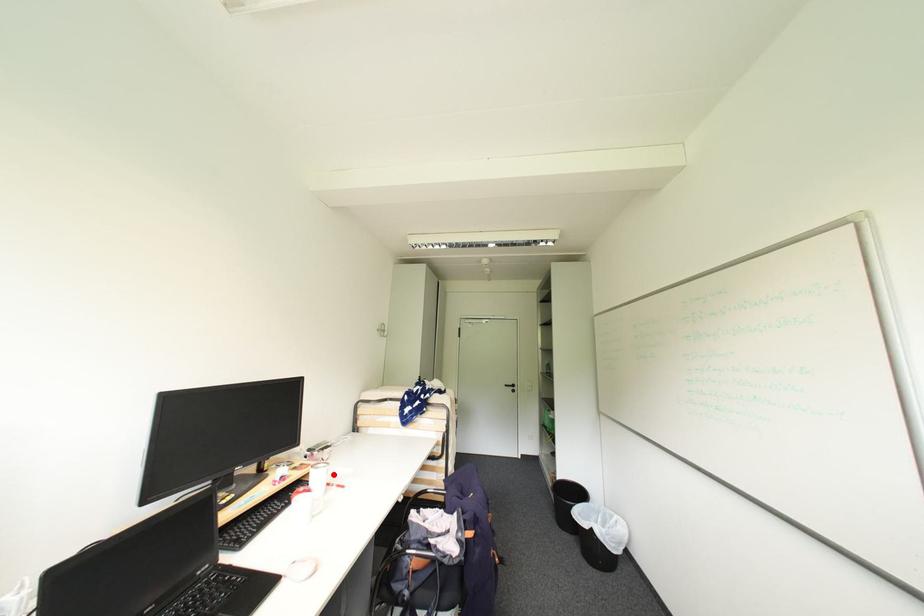
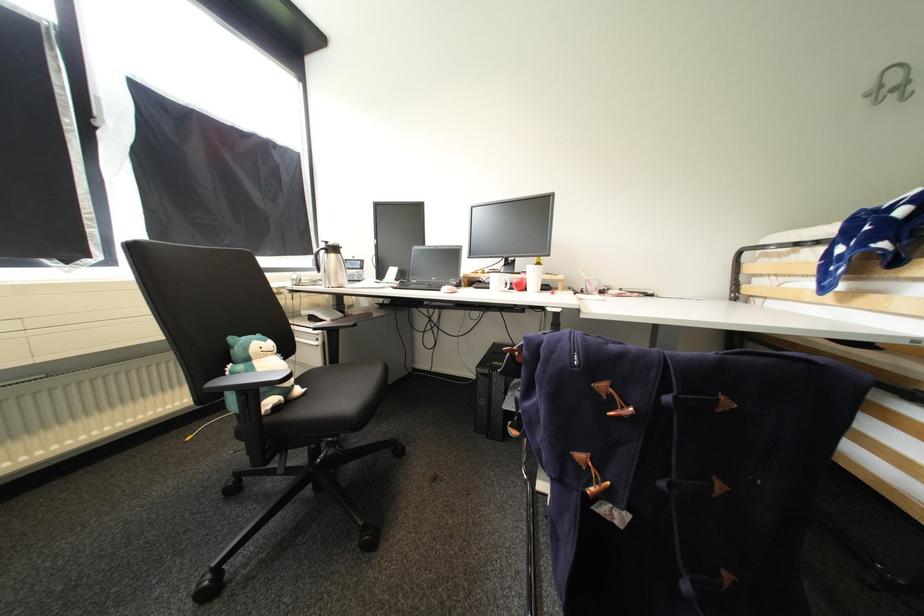
Question: I am providing you with two images of the same scene from different viewpoints. Given a red point in image1, look at the same physical point in image2. Is it:

Choices:
 (A) Closer to the viewpoint
 (B) Farther from the viewpoint

Answer: (B)